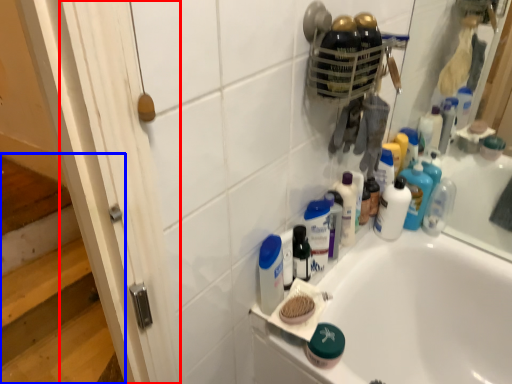
Question: Which object is further to the camera taking this photo, screen door (highlighted by a red box) or stairwell (highlighted by a blue box)?

Choices:
 (A) screen door
 (B) stairwell

Answer: (B)